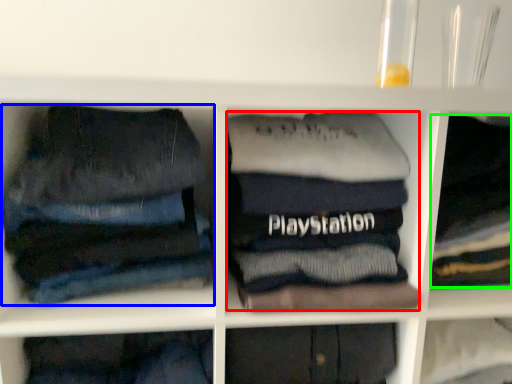
Question: Estimate the real-world distances between objects in this image. Which object is closer to clothing (highlighted by a red box), trousers (highlighted by a blue box) or clothing (highlighted by a green box)?

Choices:
 (A) trousers
 (B) clothing

Answer: (A)